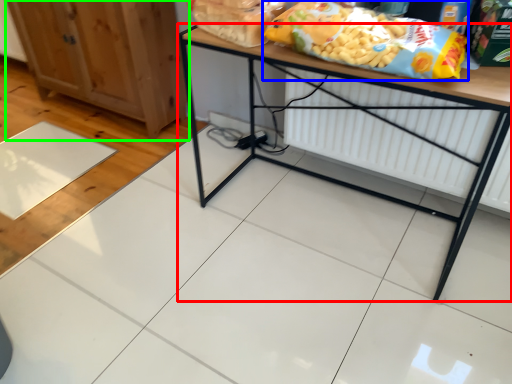
Question: Which is farther away from table (highlighted by a red box)? cereal (highlighted by a blue box) or cabinetry (highlighted by a green box)?

Choices:
 (A) cereal
 (B) cabinetry

Answer: (B)